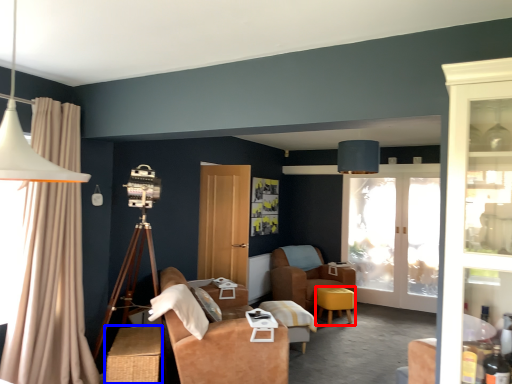
Question: Which object is closer to the camera taking this photo, stool (highlighted by a red box) or table (highlighted by a blue box)?

Choices:
 (A) stool
 (B) table

Answer: (B)